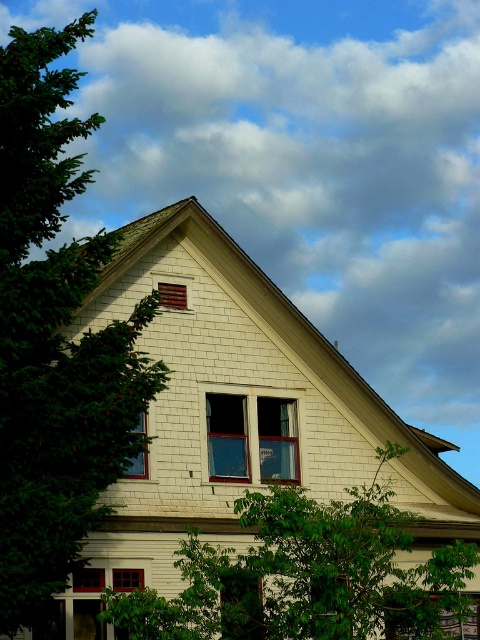
You are a painter who wants to paint all the windows in the house. You have enough paint to cover 10 square meters. The matte wooden window at lower left requires 2 liters of paint per square meter, while the matte glass window at upper center requires 1 liter per square meter. If the total paint used must not exceed 10 liters, can you paint both windows without exceeding the paint limit?

The matte wooden window at lower left occupies less space than matte glass window at upper center. Let the area of the smaller window be A. Then the larger window has an area greater than A. The total paint required would be 2A for the wooden window and 1 times the area of the glass window. Since the glass window is larger, its area is more than A, so 2A plus more than A would exceed 10 liters unless the areas are specifically calculated. However, without exact dimensions, we cannot confirm if it stays. But

You are standing in front of the house and want to locate the clear glass window at center. According to the coordinates provided, where exactly should you look to find it?

The clear glass window at center is located at point 0.684 on the horizontal axis and 0.525 on the vertical axis, so you should look towards the upper middle section of the house where these coordinates intersect.